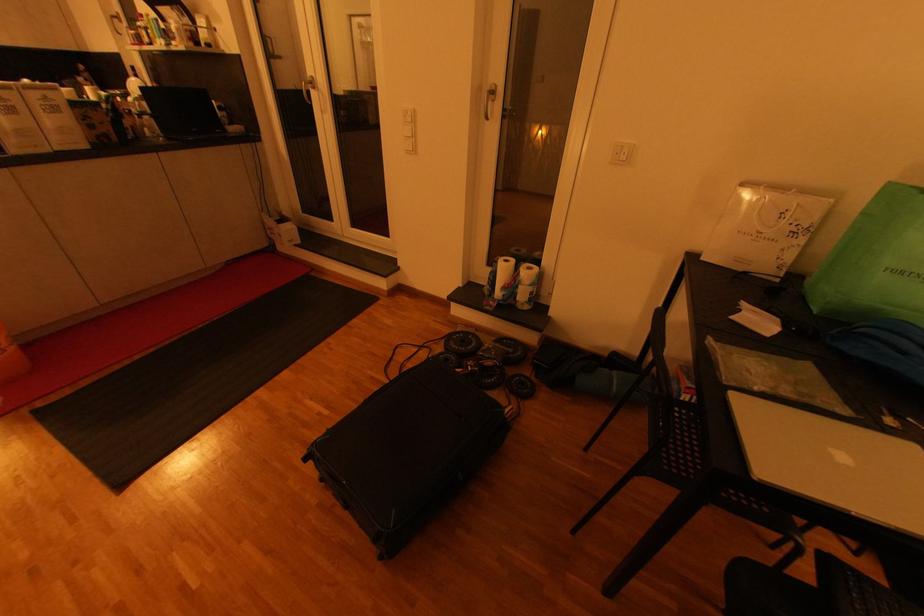
I want to click on black suitcase, so 411,450.